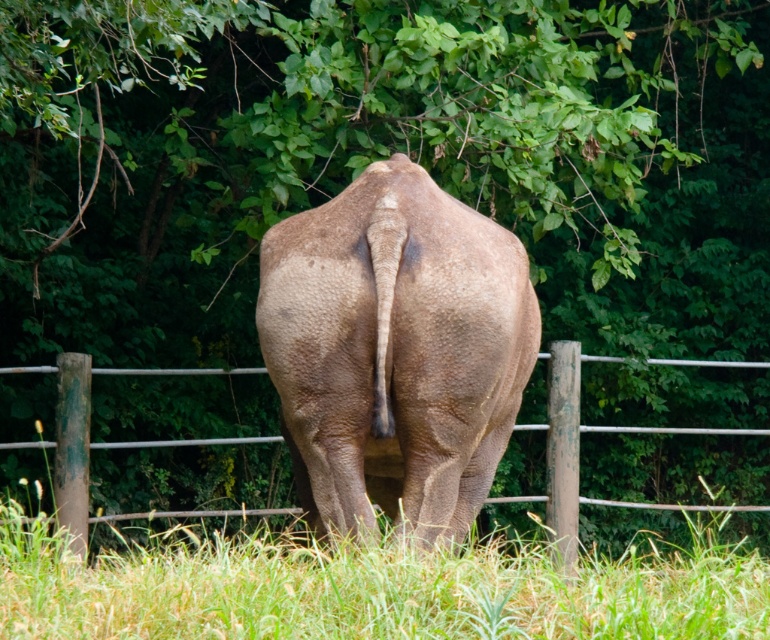
Can you confirm if gray textured elephant at center is thinner than brown wooden fence at center?

Indeed, gray textured elephant at center has a lesser width compared to brown wooden fence at center.

Is gray textured elephant at center below brown wooden fence at center?

Actually, gray textured elephant at center is above brown wooden fence at center.

Measure the distance between point (325, 435) and camera.

Point (325, 435) and camera are 5.66 meters apart.

Find the location of a particular element. This screenshot has width=770, height=640. gray textured elephant at center is located at coordinates (394, 349).